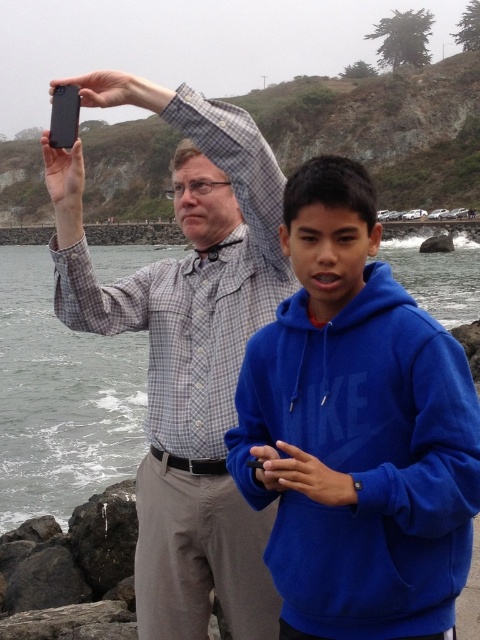
Question: Which object is the farthest from the blue fleece hoodie at center?

Choices:
 (A) gray water at lower left
 (B) matte black shirt at upper left

Answer: (A)

Question: Is blue fleece hoodie at center below matte black shirt at upper left?

Choices:
 (A) no
 (B) yes

Answer: (B)

Question: Which of the following is the closest to the observer?

Choices:
 (A) gray water at lower left
 (B) blue fleece hoodie at center

Answer: (B)

Question: Among these points, which one is nearest to the camera?

Choices:
 (A) (182, 625)
 (B) (383, 381)
 (C) (128, 394)

Answer: (B)

Question: Where is blue fleece hoodie at center located in relation to gray water at lower left in the image?

Choices:
 (A) left
 (B) right

Answer: (B)

Question: Can you confirm if blue fleece hoodie at center is thinner than matte black shirt at upper left?

Choices:
 (A) yes
 (B) no

Answer: (A)